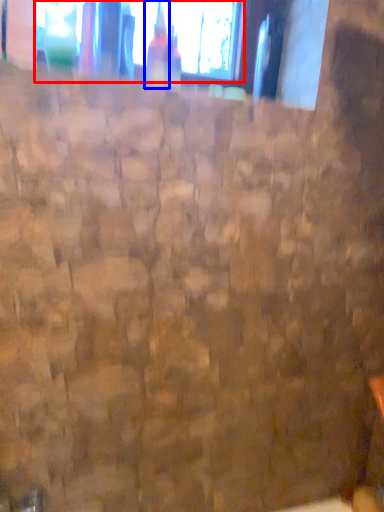
Question: Among these objects, which one is farthest to the camera, window (highlighted by a red box) or bottle (highlighted by a blue box)?

Choices:
 (A) window
 (B) bottle

Answer: (A)